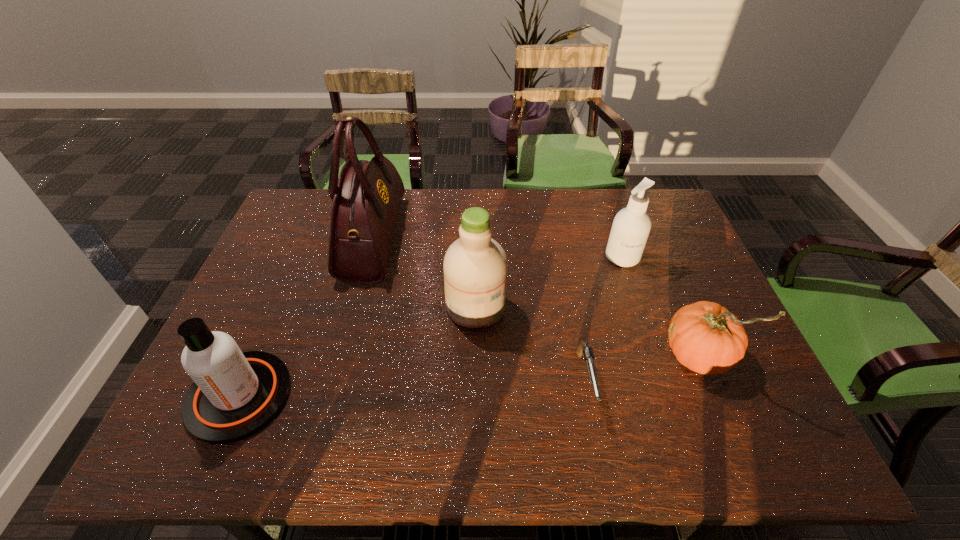
Where is `object positioned at the near left corner`? object positioned at the near left corner is located at coordinates (235, 394).

Locate an element on the screen. vacant region at the far edge of the desktop is located at coordinates (437, 199).

Find the location of a particular element. This screenshot has width=960, height=540. blank space at the left edge of the desktop is located at coordinates [x=249, y=284].

Locate an element on the screen. Image resolution: width=960 pixels, height=540 pixels. blank space at the right edge of the desktop is located at coordinates (694, 267).

Where is `vacant position at the far right corner of the desktop`? This screenshot has height=540, width=960. vacant position at the far right corner of the desktop is located at coordinates (656, 222).

Find the location of `free space between the second cleansing agent from left to right and the leftmost object`. free space between the second cleansing agent from left to right and the leftmost object is located at coordinates (357, 351).

Identify the location of free space between the leftmost cleansing agent and the second object from left to right. This screenshot has height=540, width=960. (306, 317).

The width and height of the screenshot is (960, 540). I want to click on vacant space that is in between the farthest cleansing agent and the nearest cleansing agent, so click(x=431, y=326).

You are a GUI agent. You are given a task and a screenshot of the screen. Output one action in this format:
    pyautogui.click(x=<x>, y=<y>)
    Task: Click on the free spot between the second farthest cleansing agent and the tallest object
    Image resolution: width=960 pixels, height=540 pixels.
    Given the screenshot: What is the action you would take?
    pyautogui.click(x=424, y=272)

Where is `empty location between the second cleansing agent from left to right and the farthest cleansing agent`? empty location between the second cleansing agent from left to right and the farthest cleansing agent is located at coordinates (549, 282).